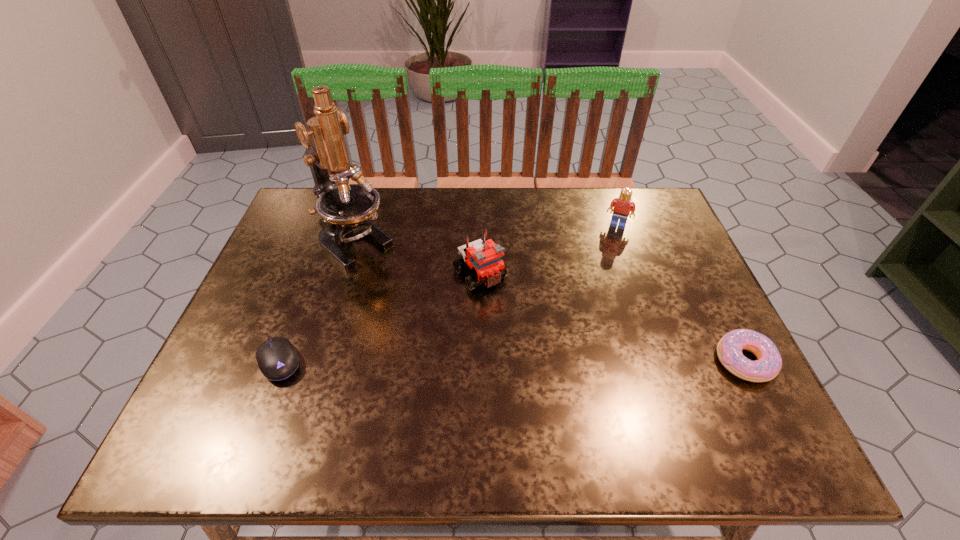
Where is `computer mouse`? Image resolution: width=960 pixels, height=540 pixels. computer mouse is located at coordinates (277, 359).

Find the location of a particular element. The height and width of the screenshot is (540, 960). doughnut is located at coordinates (729, 349).

Identify the location of the rightmost object. (729, 349).

Locate an element on the screen. the tallest object is located at coordinates (344, 208).

Locate an element on the screen. The height and width of the screenshot is (540, 960). the left Lego is located at coordinates (484, 257).

Where is `the third object from left to right`? This screenshot has height=540, width=960. the third object from left to right is located at coordinates (484, 257).

The height and width of the screenshot is (540, 960). Identify the location of the second object from right to left. (623, 205).

Image resolution: width=960 pixels, height=540 pixels. I want to click on the right Lego, so click(623, 205).

Locate an element on the screen. vacant region located 0.080m on the right of the computer mouse is located at coordinates (340, 361).

Image resolution: width=960 pixels, height=540 pixels. Find the location of `free space located on the left of the fourth tallest object`. free space located on the left of the fourth tallest object is located at coordinates (596, 361).